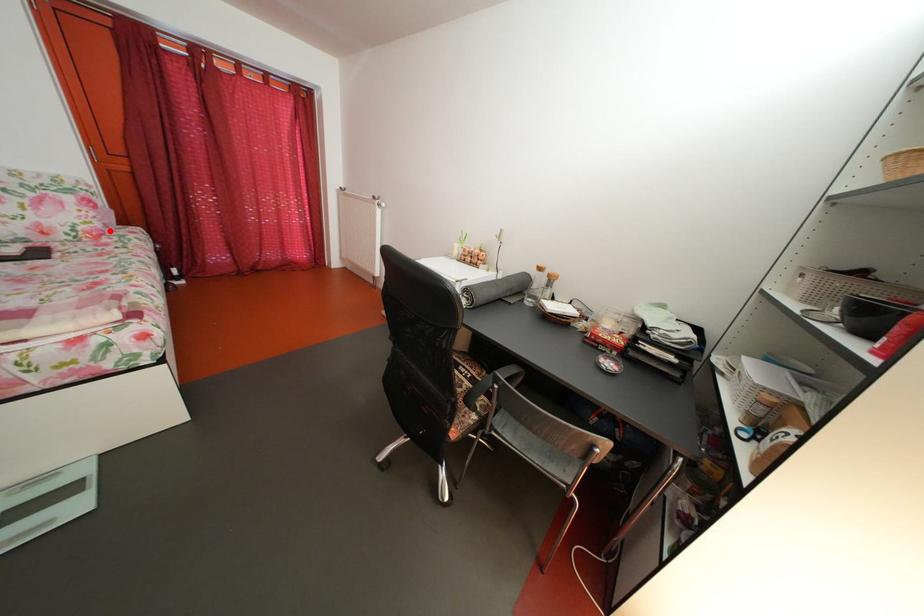
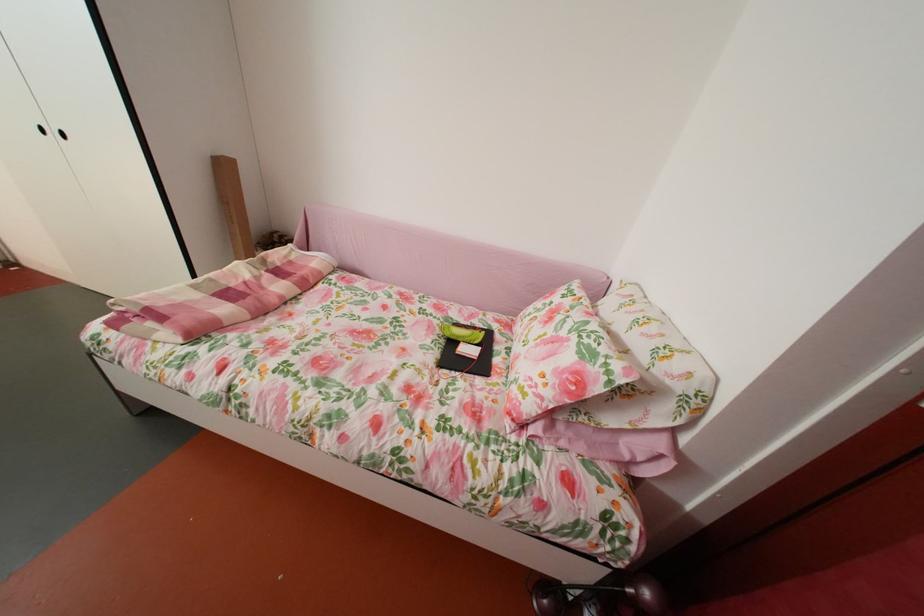
Locate, in the second image, the point that corresponds to the highlighted location in the first image.

(541, 413)